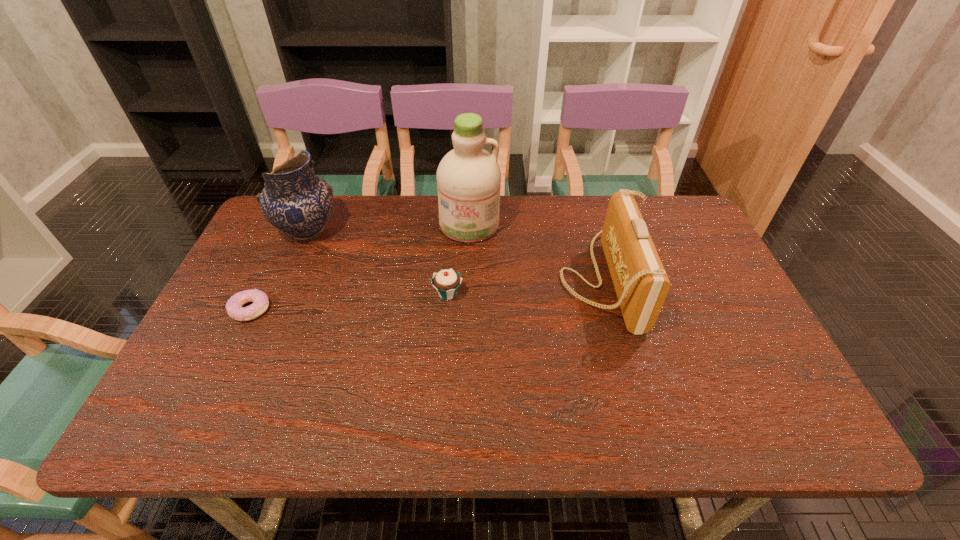
Where is `the tallest object`? The image size is (960, 540). the tallest object is located at coordinates (468, 177).

The height and width of the screenshot is (540, 960). In order to click on pottery in this screenshot , I will do `click(296, 201)`.

What are the coordinates of `handbag` in the screenshot? It's located at 640,281.

Identify the location of the rightmost object. (640, 281).

At what (x,y) coordinates should I click in order to perform the action: click on the fourth tallest object. Please return your answer as a coordinate pair (x, y). The image size is (960, 540). Looking at the image, I should click on (446, 282).

Where is `the shortest object`? the shortest object is located at coordinates (234, 308).

Locate an element on the screen. The image size is (960, 540). free region located 0.140m on the front label of the tallest object is located at coordinates (468, 278).

Where is `free location located 0.230m on the front of the pottery`? The height and width of the screenshot is (540, 960). free location located 0.230m on the front of the pottery is located at coordinates (273, 314).

Locate an element on the screen. The width and height of the screenshot is (960, 540). blank area located on the decorative side of the third tallest object is located at coordinates (535, 280).

The image size is (960, 540). What are the coordinates of `vacant space located 0.180m on the decorative side of the third tallest object` in the screenshot? It's located at (494, 280).